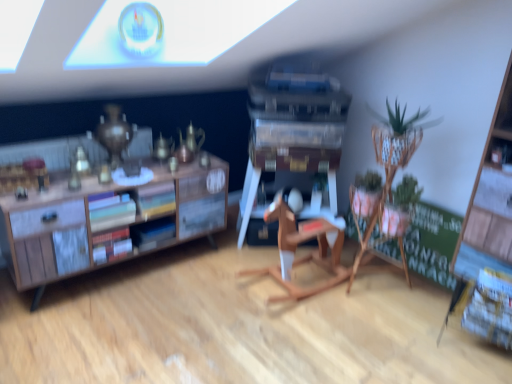
Question: Does matte hardcover books at center left, which appears as the second book when ordered from the bottom, have a lesser height compared to green chalkboard at right?

Choices:
 (A) yes
 (B) no

Answer: (A)

Question: Is matte hardcover books at center left, placed as the 1th book when sorted from top to bottom, oriented away from green chalkboard at right?

Choices:
 (A) yes
 (B) no

Answer: (B)

Question: Does matte hardcover books at center left, which appears as the second book when ordered from the bottom, have a smaller size compared to green chalkboard at right?

Choices:
 (A) yes
 (B) no

Answer: (A)

Question: Is matte hardcover books at center left, which appears as the second book when ordered from the bottom, far away from green chalkboard at right?

Choices:
 (A) yes
 (B) no

Answer: (A)

Question: Is matte hardcover books at center left, placed as the 1th book when sorted from top to bottom, wider than green chalkboard at right?

Choices:
 (A) yes
 (B) no

Answer: (A)

Question: In the image, is green chalkboard at right positioned in front of or behind matte hardcover books at center left, placed as the 1th book when sorted from top to bottom?

Choices:
 (A) behind
 (B) front

Answer: (A)

Question: Based on their sizes in the image, would you say green chalkboard at right is bigger or smaller than matte hardcover books at center left, placed as the 1th book when sorted from top to bottom?

Choices:
 (A) big
 (B) small

Answer: (A)

Question: From their relative heights in the image, would you say green chalkboard at right is taller or shorter than matte hardcover books at center left, which appears as the second book when ordered from the bottom?

Choices:
 (A) short
 (B) tall

Answer: (B)

Question: Is point (410, 268) positioned closer to the camera than point (130, 205)?

Choices:
 (A) farther
 (B) closer

Answer: (A)

Question: From the image's perspective, relative to matte hardcover books at center left, which appears as the second book when ordered from the bottom, is wooden rocking horse at center above or below?

Choices:
 (A) below
 (B) above

Answer: (A)

Question: In terms of width, does wooden rocking horse at center look wider or thinner when compared to matte hardcover books at center left, which appears as the second book when ordered from the bottom?

Choices:
 (A) thin
 (B) wide

Answer: (B)

Question: Which is correct: wooden rocking horse at center is inside matte hardcover books at center left, placed as the 1th book when sorted from top to bottom, or outside of it?

Choices:
 (A) inside
 (B) outside

Answer: (B)

Question: Considering their positions, is wooden rocking horse at center located in front of or behind matte hardcover books at center left, placed as the 1th book when sorted from top to bottom?

Choices:
 (A) behind
 (B) front

Answer: (B)

Question: Is green woven basket at upper right taller or shorter than matte hardcover books at center left, placed as the 1th book when sorted from top to bottom?

Choices:
 (A) short
 (B) tall

Answer: (B)

Question: From a real-world perspective, relative to matte hardcover books at center left, placed as the 1th book when sorted from top to bottom, is green woven basket at upper right vertically above or below?

Choices:
 (A) below
 (B) above

Answer: (A)